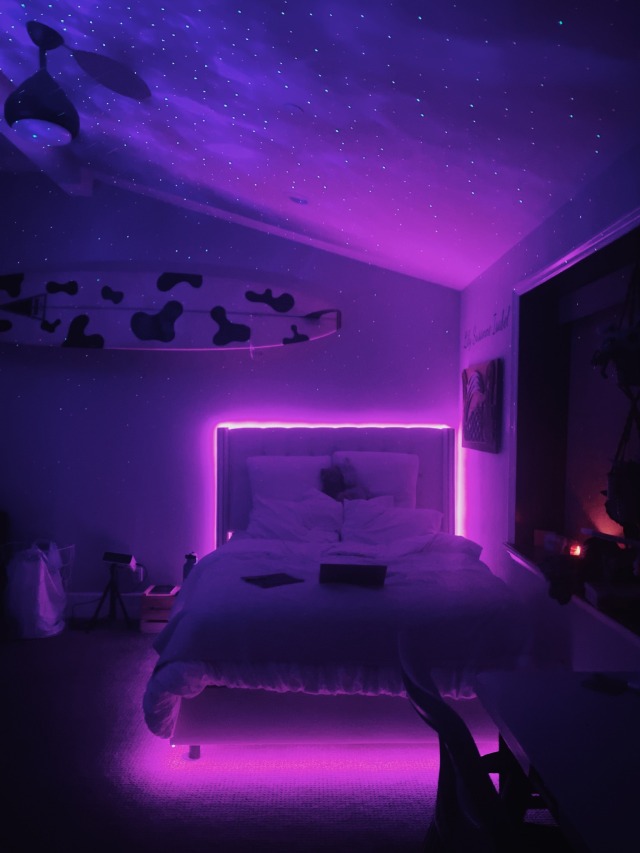
Identify the location of wall. (100, 402).